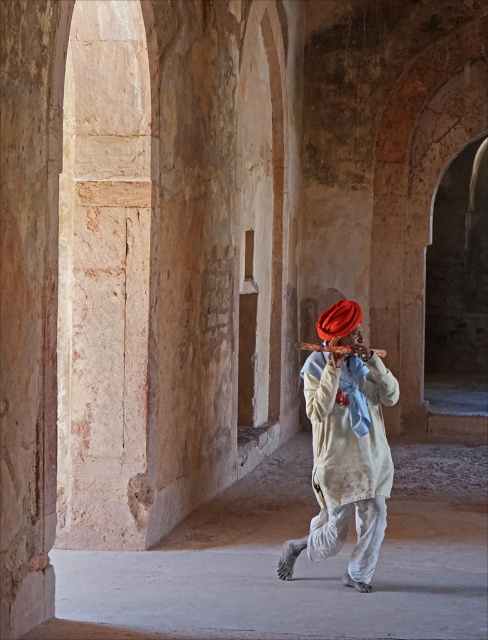
Based on the scene description, can you determine if the matte white fabric at center is wider than the shiny orange turban at center?

The matte white fabric at center is wider than the shiny orange turban at center according to the description provided.

You are an artist trying to sketch the scene. You notice the matte white fabric at center and shiny orange turban at center. Which object should you draw first if you want to depict the larger one first?

You should draw the matte white fabric at center first because it has a larger size compared to the shiny orange turban at center.

You are a photographer trying to capture the man playing the flute. You notice the matte white fabric at center and the shiny orange turban at center. Which object should you focus on first if you want to ensure both are in sharp focus?

The matte white fabric at center is further to the viewer than the shiny orange turban at center, so you should focus on the matte white fabric at center first to ensure both are in sharp focus.